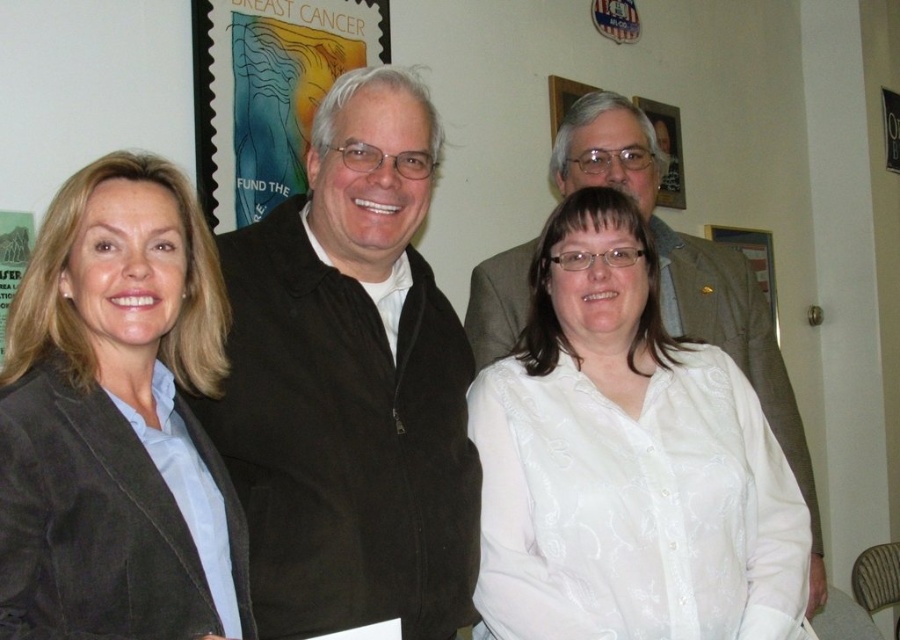
You are standing in front of the group photo and want to describe the location of the black corduroy jacket at center. What are its coordinates?

The black corduroy jacket at center is located at coordinates point (x=351, y=384).

You are organizing a charity event and need to determine which clothing item to display first based on size. Which item should you choose between the white satin blouse at center and the suede jacket at left?

The white satin blouse at center has a larger size compared to the suede jacket at left, so you should display the white satin blouse at center first.

You are a photographer setting up for a group photo. You notice the suede jacket at left and the breast cancer awareness poster at upper left. Which object is positioned higher in the image?

The breast cancer awareness poster at upper left is positioned higher than the suede jacket at left.